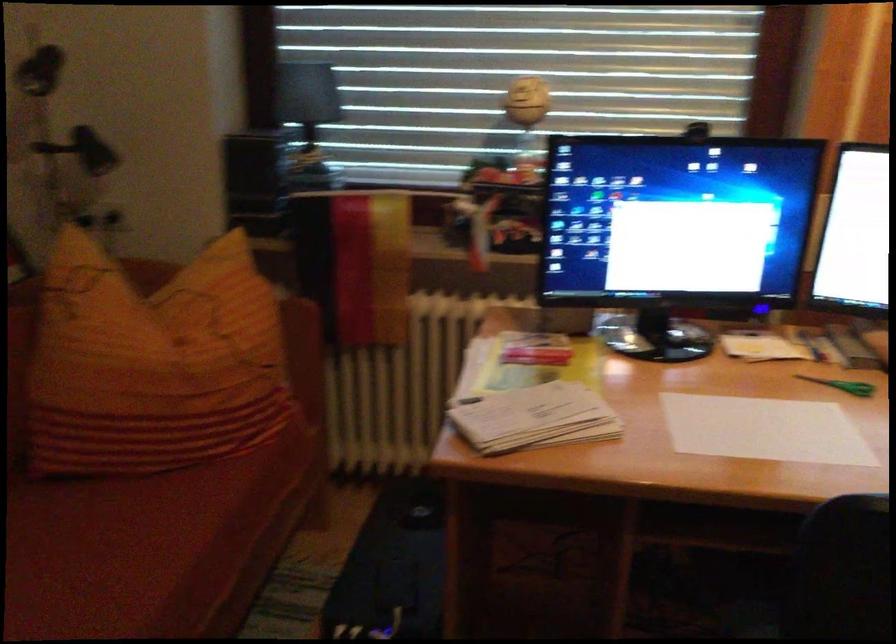
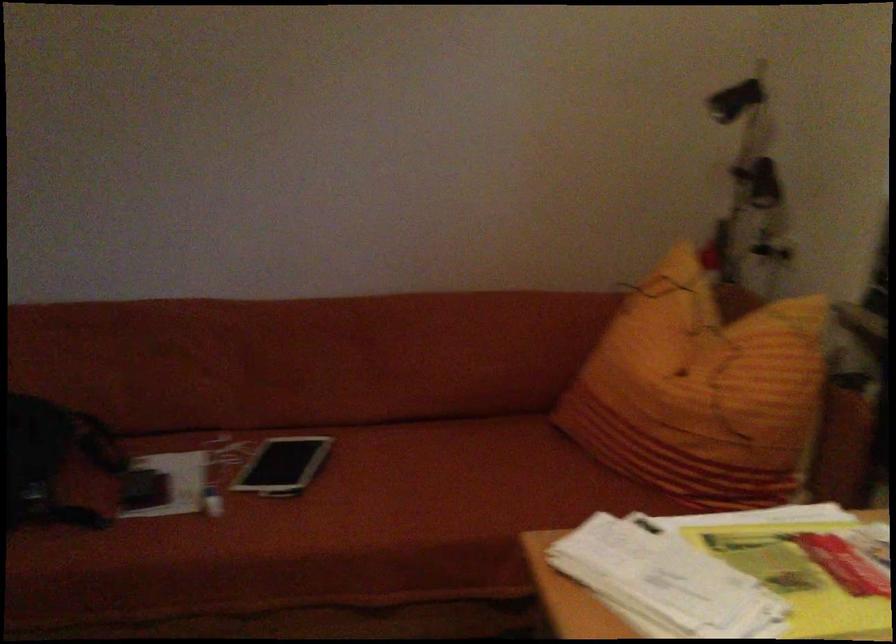
Question: The images are taken continuously from a first-person perspective. In which direction is your viewpoint rotating?

Choices:
 (A) Left
 (B) Right
 (C) Up
 (D) Down

Answer: (A)